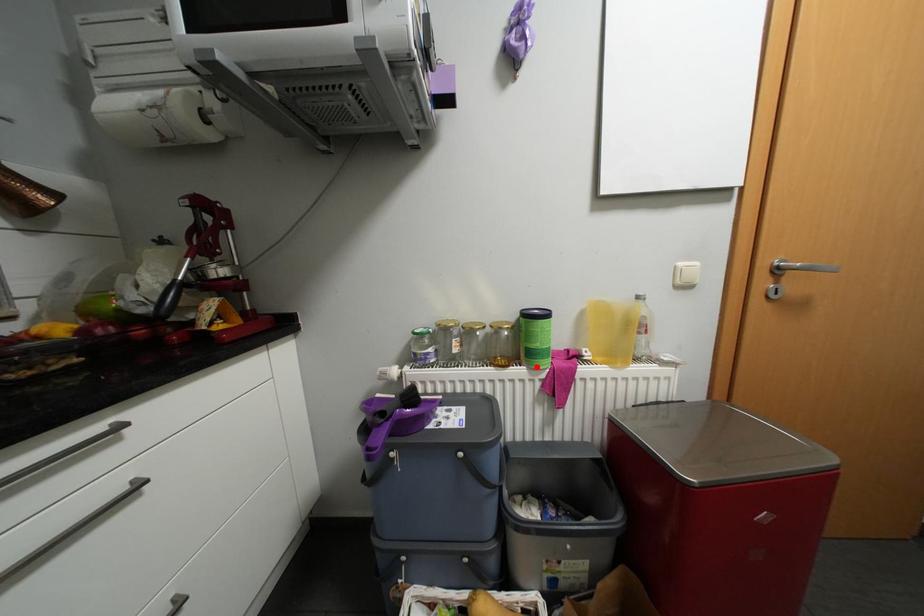
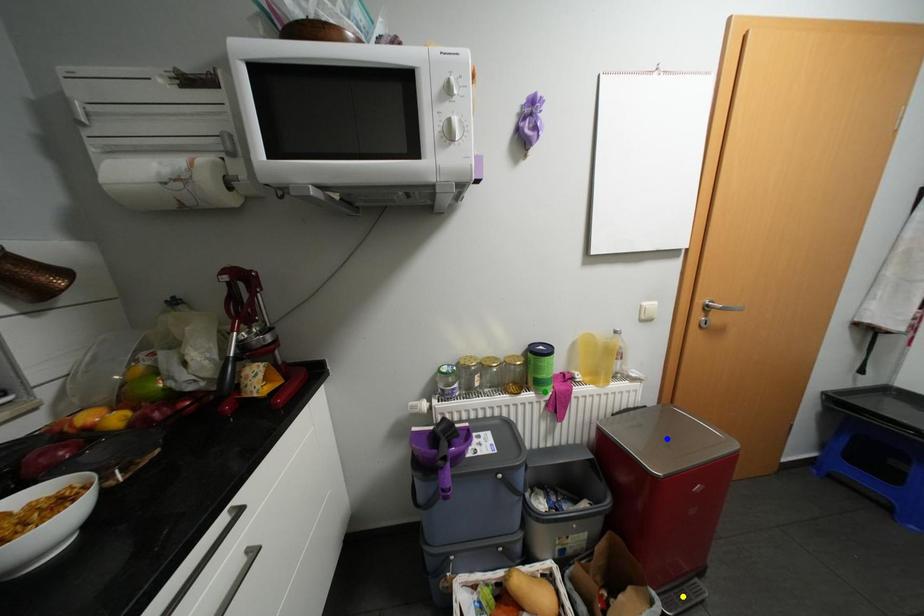
Question: I am providing you with two images of the same scene from different viewpoints. A red point is marked on the first image. You are given multiple points on the second image. Which spot in image 2 lines up with the point in image 1?

Choices:
 (A) yellow point
 (B) green point
 (C) blue point

Answer: (B)